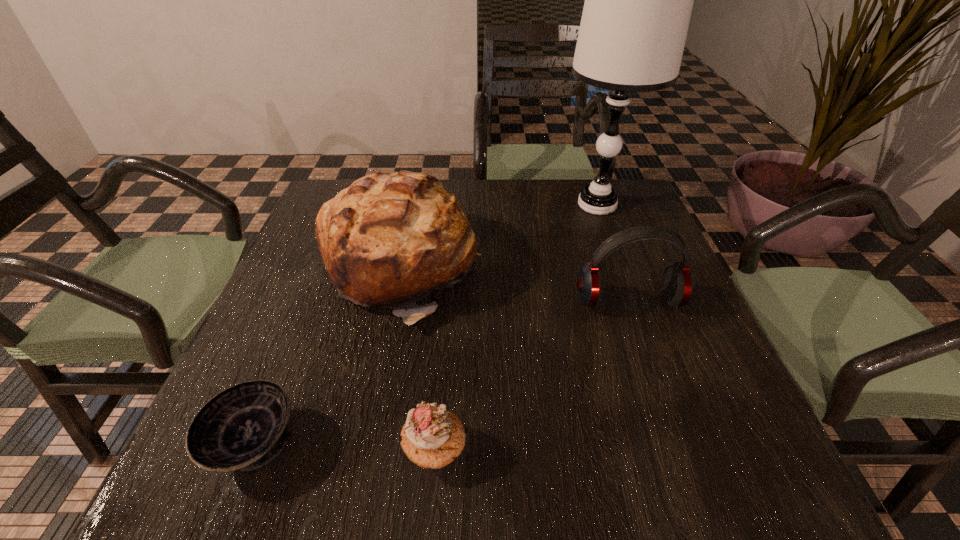
You are a GUI agent. You are given a task and a screenshot of the screen. Output one action in this format:
    pyautogui.click(x=<x>, y=<y>)
    Task: Click on the object present at the far right corner
    
    Given the screenshot: What is the action you would take?
    click(x=638, y=2)

Identify the location of blank space at the far edge of the desktop. This screenshot has width=960, height=540. (574, 191).

In the image, there is a desktop. At what (x,y) coordinates should I click in order to perform the action: click on vacant space at the near edge. Please return your answer as a coordinate pair (x, y). This screenshot has width=960, height=540. Looking at the image, I should click on (500, 454).

This screenshot has width=960, height=540. I want to click on vacant space at the right edge of the desktop, so click(674, 386).

This screenshot has height=540, width=960. Identify the location of vacant position at the far right corner of the desktop. pyautogui.click(x=584, y=180).

Locate an element on the screen. This screenshot has height=540, width=960. blank region between the bowl and the tallest object is located at coordinates (425, 325).

Locate an element on the screen. The height and width of the screenshot is (540, 960). empty location between the third shortest object and the bowl is located at coordinates (442, 372).

Locate an element on the screen. This screenshot has height=540, width=960. free space between the cupcake and the shortest object is located at coordinates (345, 447).

The width and height of the screenshot is (960, 540). Identify the location of free space between the bread and the tallest object. [x=498, y=236].

At what (x,y) coordinates should I click in order to perform the action: click on empty space between the second shortest object and the third tallest object. Please return your answer as a coordinate pair (x, y). Looking at the image, I should click on (532, 375).